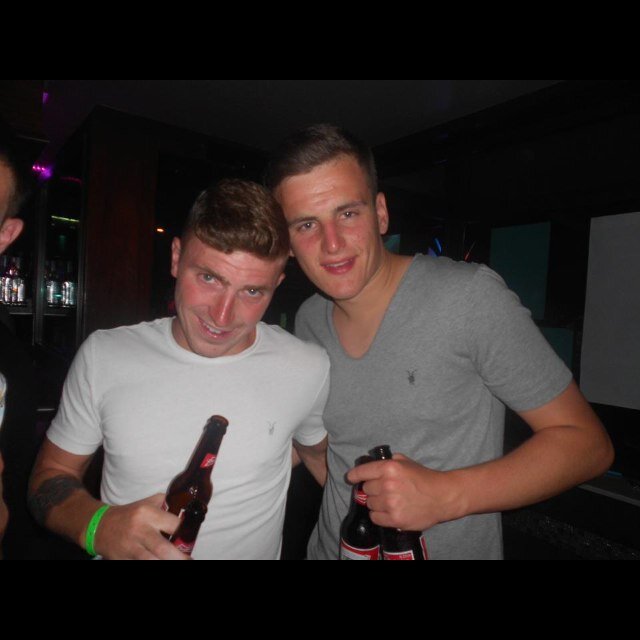
Where is `beer bottles`? beer bottles is located at coordinates (189, 486).